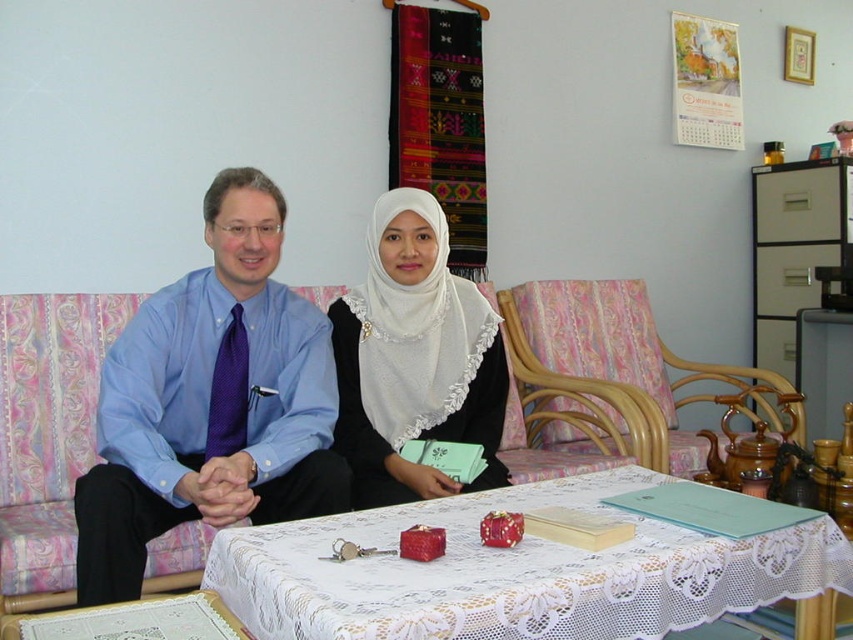
Question: Does blue satin shirt at center have a larger size compared to blue fabric armchair at left?

Choices:
 (A) yes
 (B) no

Answer: (B)

Question: Which of the following is the closest to the observer?

Choices:
 (A) (561, 340)
 (B) (544, 557)
 (C) (41, 356)
 (D) (341, 330)

Answer: (B)

Question: Is wooden armchair at center positioned in front of blue fabric armchair at left?

Choices:
 (A) no
 (B) yes

Answer: (A)

Question: Which point is farther to the camera?

Choices:
 (A) white lace hijab at center
 (B) wooden armchair at center
 (C) blue fabric armchair at left
 (D) blue satin shirt at center

Answer: (B)

Question: Which point appears closest to the camera in this image?

Choices:
 (A) (616, 412)
 (B) (250, 458)

Answer: (B)

Question: Can you confirm if wooden armchair at center is positioned below blue fabric armchair at left?

Choices:
 (A) yes
 (B) no

Answer: (B)